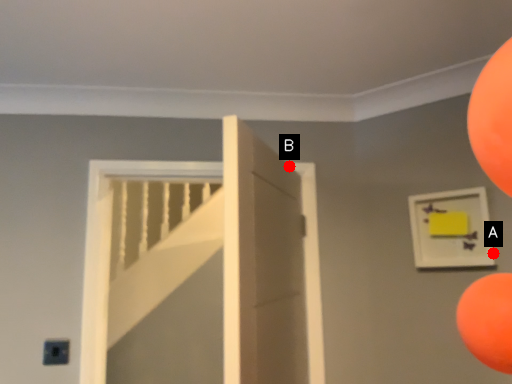
Question: Two points are circled on the image, labeled by A and B beside each circle. Which of the following is the closest to the observer?

Choices:
 (A) A is closer
 (B) B is closer

Answer: (A)